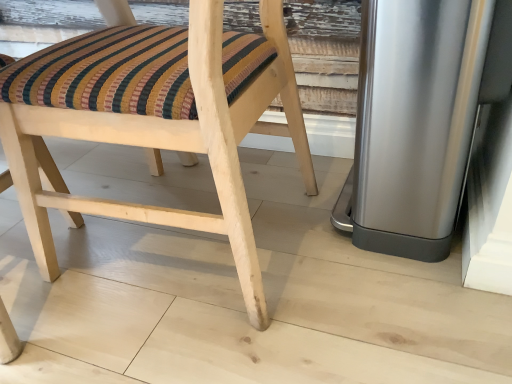
The image size is (512, 384). I want to click on vacant space underneath natural wood chair at center (from a real-world perspective), so click(215, 250).